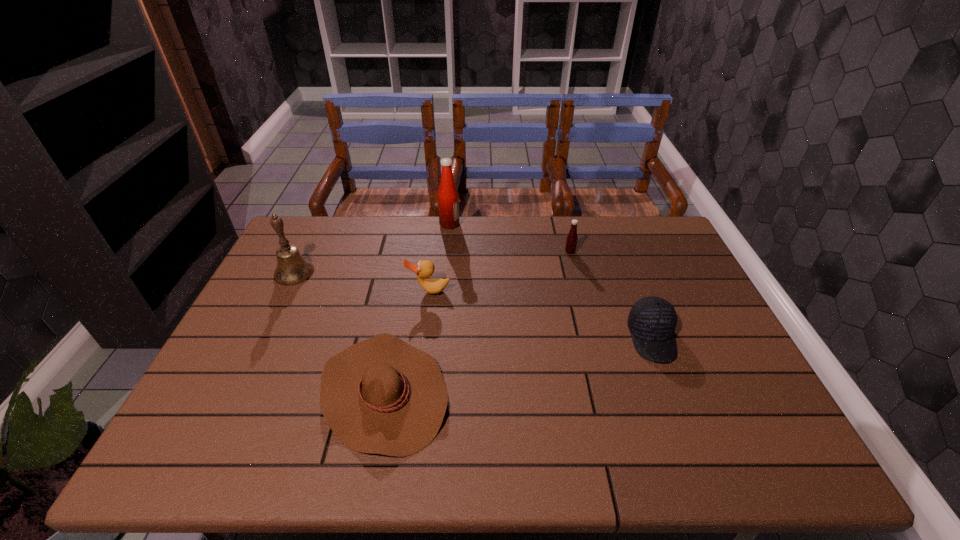
Find the location of a particular element. empty location between the leftmost object and the baseball cap is located at coordinates (473, 305).

Locate an element on the screen. vacant space in between the rightmost object and the fifth object from left to right is located at coordinates (611, 295).

Locate an element on the screen. This screenshot has width=960, height=540. object that can be found as the second closest to the duck is located at coordinates (448, 198).

What are the coordinates of `the closest object to the fifth object from left to right` in the screenshot? It's located at 652,320.

Locate an element on the screen. This screenshot has height=540, width=960. vacant space that satisfies the following two spatial constraints: 1. on the back side of the fifth object from left to right; 2. on the left side of the leftmost object is located at coordinates (304, 252).

Locate an element on the screen. The image size is (960, 540). vacant space that satisfies the following two spatial constraints: 1. on the front-facing side of the Tabasco sauce; 2. on the right side of the farthest object is located at coordinates (447, 252).